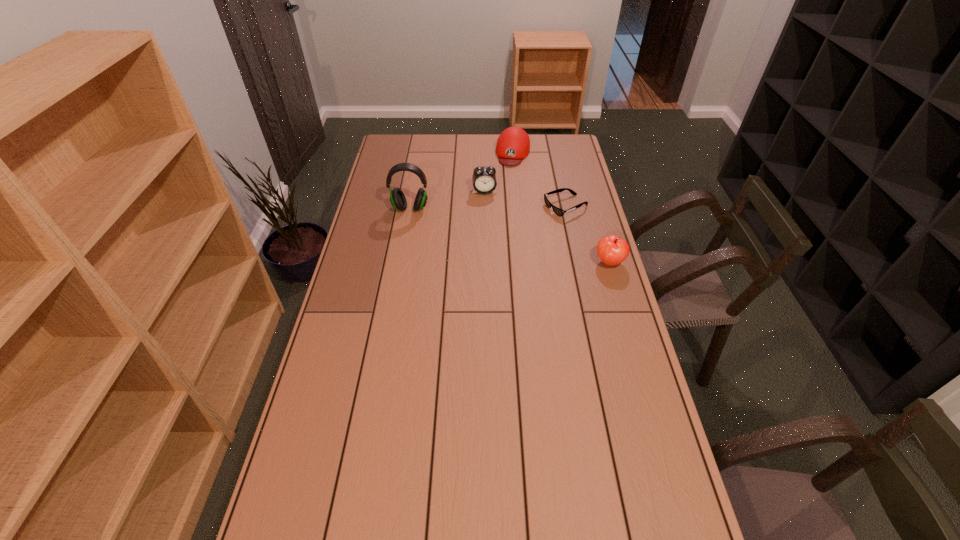
Where is `apple situated at the right edge`? The height and width of the screenshot is (540, 960). apple situated at the right edge is located at coordinates (612, 250).

Where is `sunglasses that is at the right edge`? This screenshot has height=540, width=960. sunglasses that is at the right edge is located at coordinates (557, 211).

Identify the location of free location at the far edge. (472, 158).

The image size is (960, 540). In order to click on vacant region at the left edge in this screenshot , I will do `click(344, 292)`.

In the image, there is a desktop. Identify the location of vacant area at the right edge. point(551,182).

Image resolution: width=960 pixels, height=540 pixels. I want to click on free space at the far left corner, so click(x=420, y=139).

The image size is (960, 540). Identify the location of vacant area that lies between the alarm clock and the nearest object. (547, 227).

You are a GUI agent. You are given a task and a screenshot of the screen. Output one action in this format:
    pyautogui.click(x=<x>, y=<y>)
    Task: Click on the vacant space that is in between the third object from left to right and the fourth object from right to left
    
    Given the screenshot: What is the action you would take?
    pyautogui.click(x=499, y=172)

Where is `vacant area that lies between the headset and the baseball cap`? vacant area that lies between the headset and the baseball cap is located at coordinates (462, 180).

Identify the location of blank region between the apple and the tallest object. The width and height of the screenshot is (960, 540). coord(510,235).